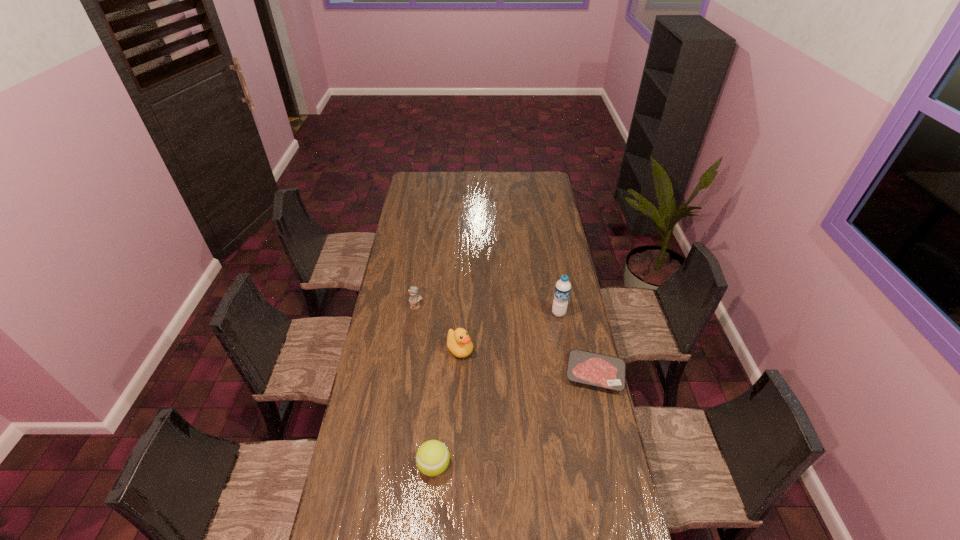
Find the location of `free space at the left edge`. free space at the left edge is located at coordinates (399, 274).

This screenshot has height=540, width=960. In the image, there is a desktop. Identify the location of free space at the right edge. (562, 273).

Where is `free area in between the duck and the nearest object`? This screenshot has height=540, width=960. free area in between the duck and the nearest object is located at coordinates (447, 408).

The width and height of the screenshot is (960, 540). I want to click on free point between the steak and the nearest object, so click(515, 420).

This screenshot has width=960, height=540. I want to click on vacant area between the leftmost object and the nearest object, so click(x=425, y=386).

Locate an element on the screen. This screenshot has width=960, height=540. free space between the tennis ball and the duck is located at coordinates (447, 408).

Where is `vacant space that's between the fourth shortest object and the leftmost object`? The image size is (960, 540). vacant space that's between the fourth shortest object and the leftmost object is located at coordinates (439, 328).

Image resolution: width=960 pixels, height=540 pixels. In order to click on vacant area between the second tallest object and the tennis ball in this screenshot , I will do coord(447,408).

Where is `vacant area that lies between the leftmost object and the steak`? vacant area that lies between the leftmost object and the steak is located at coordinates (506, 340).

The height and width of the screenshot is (540, 960). I want to click on free space that is in between the nearest object and the steak, so click(x=515, y=420).